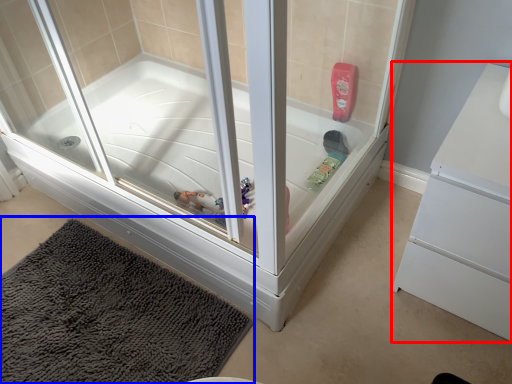
Question: Which object appears farthest to the camera in this image, dresser (highlighted by a red box) or bath mat (highlighted by a blue box)?

Choices:
 (A) dresser
 (B) bath mat

Answer: (B)